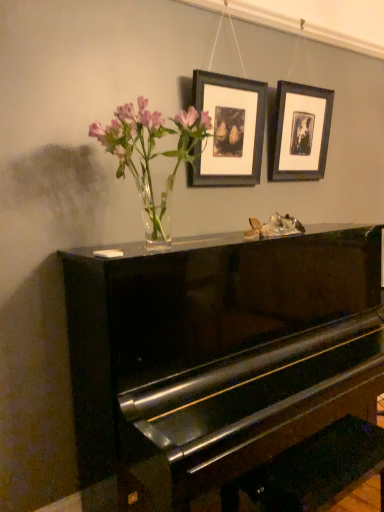
Question: Considering the relative sizes of clear glass vase at upper center and glossy black piano at center in the image provided, is clear glass vase at upper center smaller than glossy black piano at center?

Choices:
 (A) no
 (B) yes

Answer: (B)

Question: From a real-world perspective, is clear glass vase at upper center on glossy black piano at center?

Choices:
 (A) yes
 (B) no

Answer: (A)

Question: Is the depth of clear glass vase at upper center greater than that of glossy black piano at center?

Choices:
 (A) no
 (B) yes

Answer: (B)

Question: Does clear glass vase at upper center have a lesser height compared to glossy black piano at center?

Choices:
 (A) yes
 (B) no

Answer: (A)

Question: Are clear glass vase at upper center and glossy black piano at center far apart?

Choices:
 (A) no
 (B) yes

Answer: (A)

Question: Considering the positions of clear glass vase at upper center and glossy black piano at center in the image, is clear glass vase at upper center bigger or smaller than glossy black piano at center?

Choices:
 (A) small
 (B) big

Answer: (A)

Question: In the image, is clear glass vase at upper center positioned in front of or behind glossy black piano at center?

Choices:
 (A) front
 (B) behind

Answer: (B)

Question: Is clear glass vase at upper center wider or thinner than glossy black piano at center?

Choices:
 (A) thin
 (B) wide

Answer: (A)

Question: From a real-world perspective, is clear glass vase at upper center physically located above or below glossy black piano at center?

Choices:
 (A) above
 (B) below

Answer: (A)

Question: Based on their sizes in the image, would you say clear glass vase at upper center is bigger or smaller than matte black picture frame at upper right, marked as the second picture frame in a left-to-right arrangement?

Choices:
 (A) small
 (B) big

Answer: (B)

Question: From the image's perspective, is clear glass vase at upper center positioned above or below matte black picture frame at upper right, acting as the 1th picture frame starting from the back?

Choices:
 (A) above
 (B) below

Answer: (B)

Question: In the image, is clear glass vase at upper center positioned in front of or behind matte black picture frame at upper right, the 2th picture frame positioned from the front?

Choices:
 (A) behind
 (B) front

Answer: (B)

Question: In terms of width, does clear glass vase at upper center look wider or thinner when compared to matte black picture frame at upper right, the 2th picture frame positioned from the front?

Choices:
 (A) thin
 (B) wide

Answer: (B)

Question: Considering their positions, is matte black picture frame at upper right, marked as the second picture frame in a left-to-right arrangement, located in front of or behind glossy black piano at center?

Choices:
 (A) front
 (B) behind

Answer: (B)

Question: In terms of size, does matte black picture frame at upper right, marked as the second picture frame in a left-to-right arrangement, appear bigger or smaller than glossy black piano at center?

Choices:
 (A) small
 (B) big

Answer: (A)